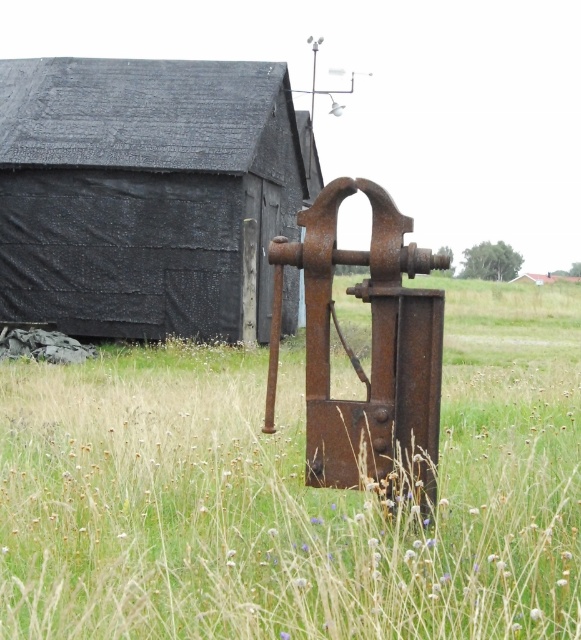
Question: In this image, where is dry grass at center located relative to rusty metal barn at center?

Choices:
 (A) above
 (B) below

Answer: (B)

Question: Which of the following is the closest to the observer?

Choices:
 (A) (514, 392)
 (B) (242, 288)

Answer: (A)

Question: Is dry grass at center bigger than rusty metal barn at center?

Choices:
 (A) no
 (B) yes

Answer: (B)

Question: From the image, what is the correct spatial relationship of dry grass at center in relation to rusty metal barn at center?

Choices:
 (A) above
 (B) below

Answer: (B)

Question: Which point is closer to the camera?

Choices:
 (A) rusty metal barn at center
 (B) dry grass at center

Answer: (B)